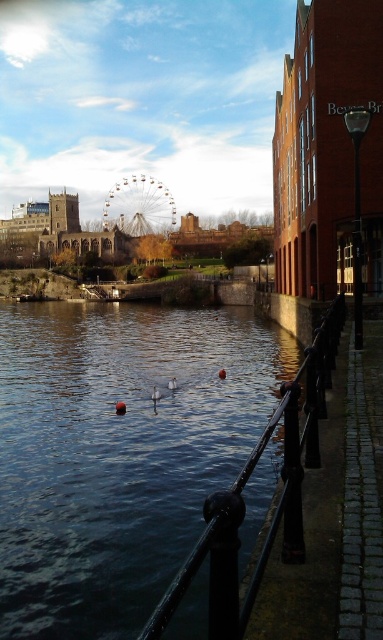
Consider the image. Does black metal rail at lower center have a lesser width compared to metallic ferris wheel at center?

Yes.

Does black metal rail at lower center come in front of metallic ferris wheel at center?

Yes, it is in front of metallic ferris wheel at center.

The height and width of the screenshot is (640, 383). Describe the element at coordinates (243, 502) in the screenshot. I see `black metal rail at lower center` at that location.

Identify the location of black metal rail at lower center. (243, 502).